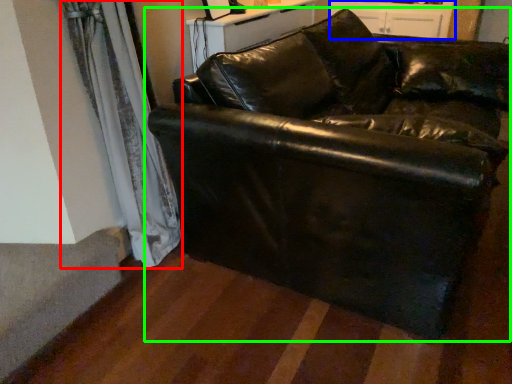
Question: Considering the real-world distances, which object is farthest from curtain (highlighted by a red box)? dresser (highlighted by a blue box) or studio couch (highlighted by a green box)?

Choices:
 (A) dresser
 (B) studio couch

Answer: (A)